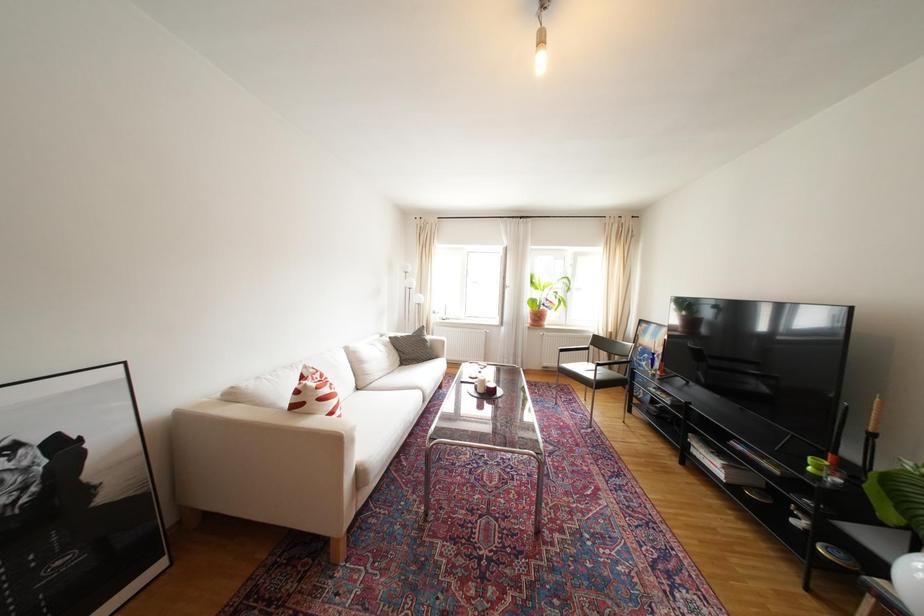
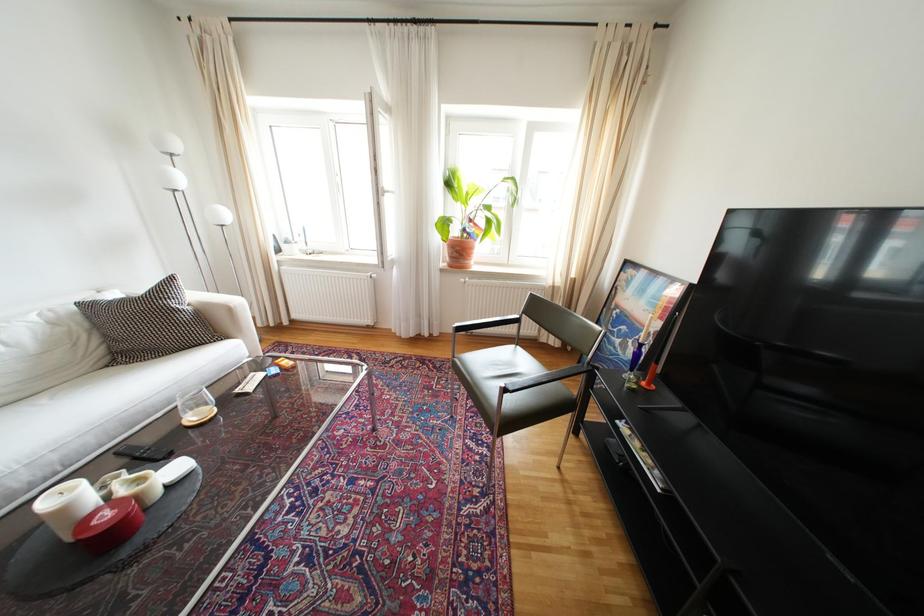
What movement of the cameraman would produce the second image?

The cameraman walked toward right, forward.